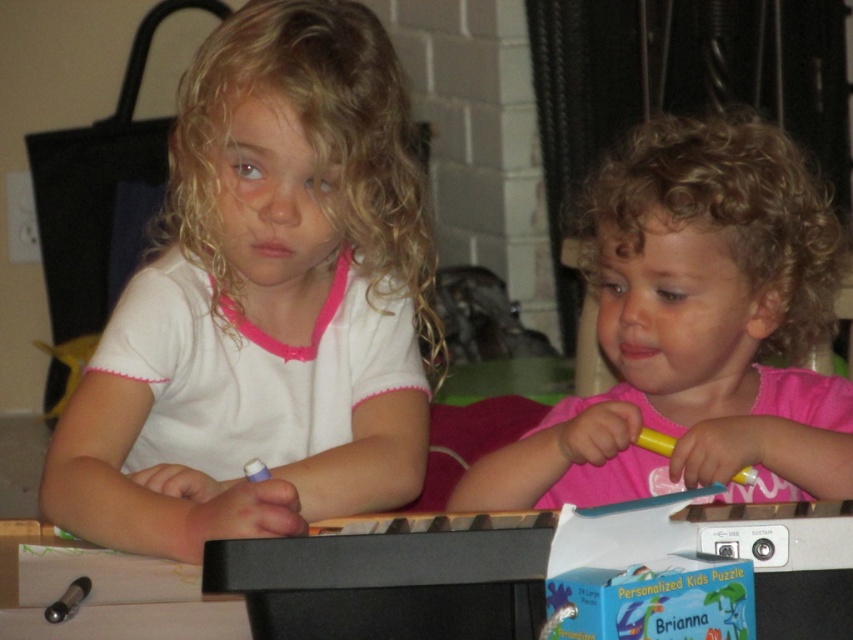
Question: Observing the image, what is the correct spatial positioning of pink matte shirt at center in reference to yellow matte crayon at lower center?

Choices:
 (A) right
 (B) left

Answer: (A)

Question: Does white matte shirt at center appear on the right side of pink matte shirt at center?

Choices:
 (A) no
 (B) yes

Answer: (A)

Question: Estimate the real-world distances between objects in this image. Which object is farther from the white matte shirt at center?

Choices:
 (A) pink matte shirt at center
 (B) yellow matte crayon at lower center

Answer: (B)

Question: Which object is the closest to the yellow matte crayon at lower center?

Choices:
 (A) white matte shirt at center
 (B) pink matte shirt at center

Answer: (B)

Question: Estimate the real-world distances between objects in this image. Which object is closer to the yellow matte crayon at lower center?

Choices:
 (A) white matte shirt at center
 (B) pink matte shirt at center

Answer: (B)

Question: In this image, where is white matte shirt at center located relative to pink matte shirt at center?

Choices:
 (A) right
 (B) left

Answer: (B)